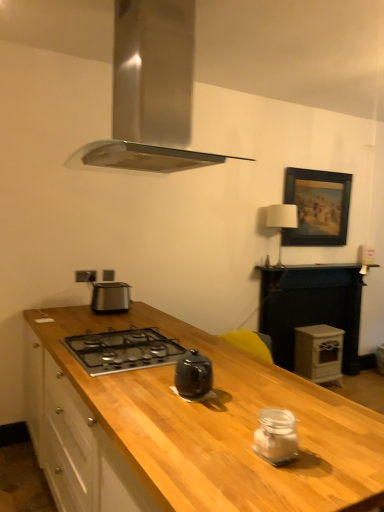
Question: Visually, is stainless steel range hood at upper center positioned to the left or to the right of white matte wood stove at right?

Choices:
 (A) right
 (B) left

Answer: (B)

Question: Considering the positions of stainless steel range hood at upper center and white matte wood stove at right in the image, is stainless steel range hood at upper center wider or thinner than white matte wood stove at right?

Choices:
 (A) wide
 (B) thin

Answer: (A)

Question: Which is farther from the wooden framed painting at upper right?

Choices:
 (A) satin silver outlet at lower left
 (B) white fabric lampshade at upper right
 (C) clear glass jar at center, arranged as the 2th kitchen appliance when viewed from the top
 (D) wooden at center
 (E) white matte wood stove at right

Answer: (C)

Question: Estimate the real-world distances between objects in this image. Which object is closer to the wooden at center?

Choices:
 (A) wooden at right
 (B) white matte wood stove at right
 (C) satin silver toaster at center, the 2th kitchen appliance in the bottom-to-top sequence
 (D) clear glass jar at center, which ranks as the 1th kitchen appliance in bottom-to-top order
 (E) satin silver outlet at lower left

Answer: (D)